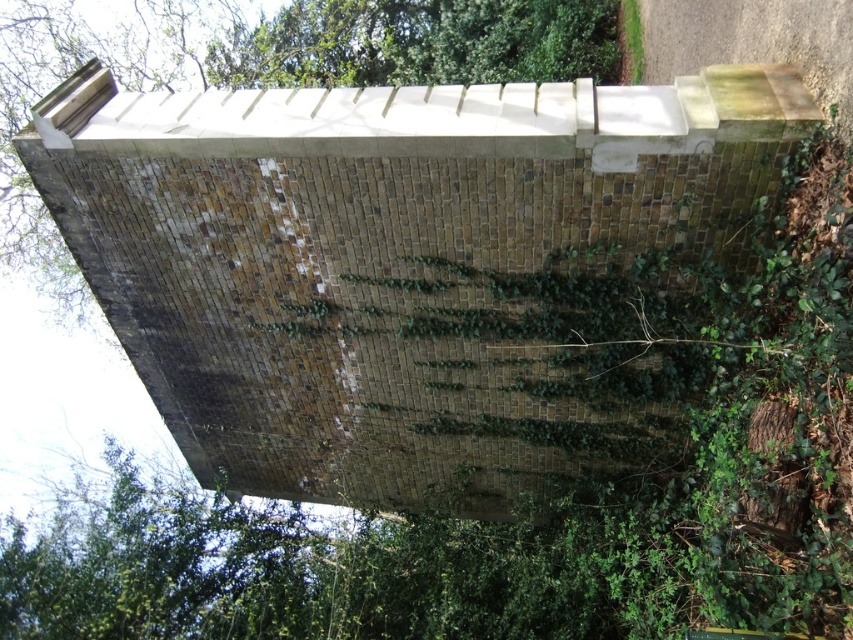
Question: Which object is farther from the camera taking this photo?

Choices:
 (A) green leafy tree at upper center
 (B) brick wall at center

Answer: (B)

Question: Which point is closer to the camera taking this photo?

Choices:
 (A) (468, 80)
 (B) (605, 77)

Answer: (B)

Question: Is the position of brick wall at center more distant than that of green leafy tree at upper center?

Choices:
 (A) yes
 (B) no

Answer: (A)

Question: Does brick wall at center have a smaller size compared to green leafy tree at upper center?

Choices:
 (A) yes
 (B) no

Answer: (B)

Question: Which of the following is the farthest from the observer?

Choices:
 (A) (381, 65)
 (B) (502, 12)

Answer: (A)

Question: Does brick wall at center have a greater width compared to green leafy tree at upper center?

Choices:
 (A) no
 (B) yes

Answer: (B)